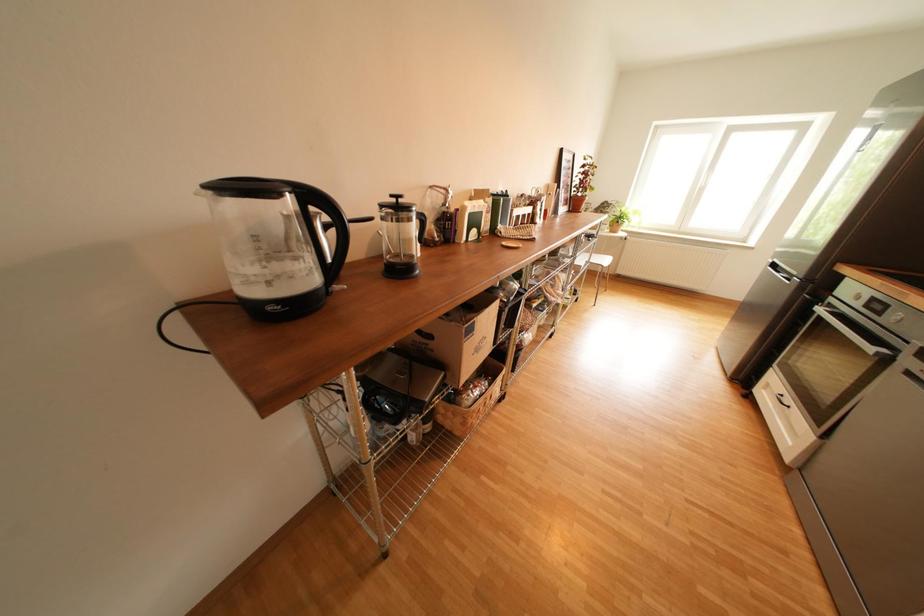
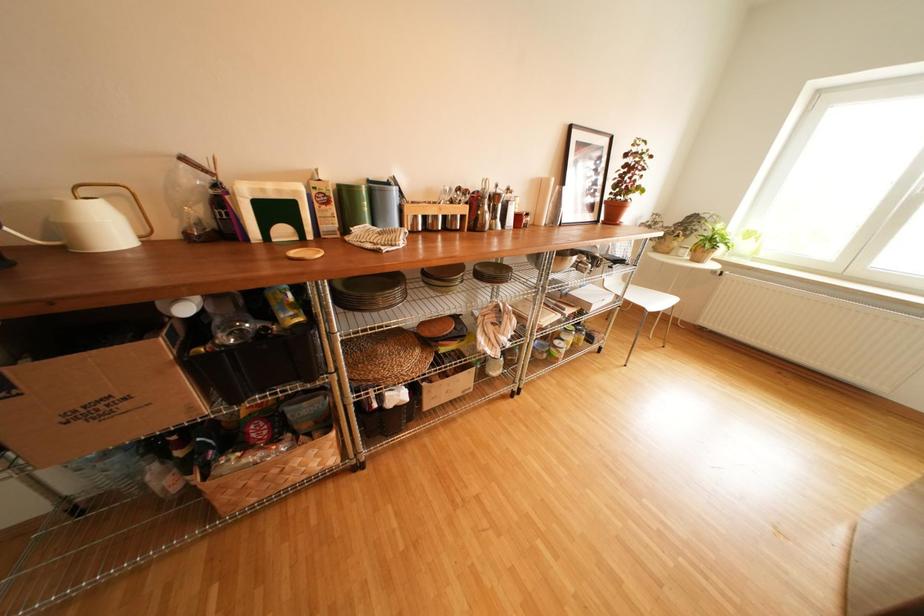
In a continuous first-person perspective shot, in which direction is the camera moving?

The cameraman moved toward right, forward.